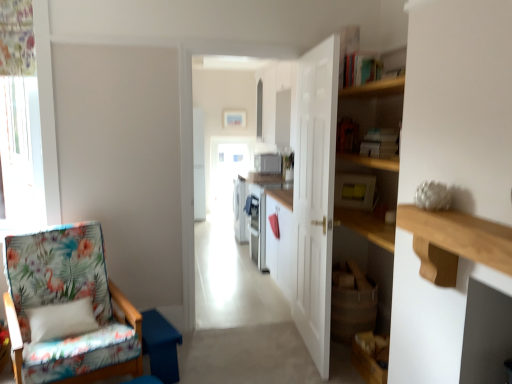
Question: From a real-world perspective, does white wooden door at center sit lower than wooden at right?

Choices:
 (A) no
 (B) yes

Answer: (B)

Question: Is white wooden door at center not close to wooden at right?

Choices:
 (A) yes
 (B) no

Answer: (A)

Question: From a real-world perspective, is white wooden door at center over wooden at right?

Choices:
 (A) yes
 (B) no

Answer: (B)

Question: Does white wooden door at center have a greater height compared to wooden at right?

Choices:
 (A) no
 (B) yes

Answer: (B)

Question: Is the depth of white wooden door at center less than that of wooden at right?

Choices:
 (A) yes
 (B) no

Answer: (B)

Question: Can you confirm if white wooden door at center is thinner than wooden at right?

Choices:
 (A) no
 (B) yes

Answer: (B)

Question: Can you confirm if white glossy microwave at center is wider than yellow plastic microwave at upper center, the 1th appliance positioned from the front?

Choices:
 (A) no
 (B) yes

Answer: (B)

Question: Considering the relative sizes of white glossy microwave at center and yellow plastic microwave at upper center, the 1th appliance positioned from the front, in the image provided, is white glossy microwave at center shorter than yellow plastic microwave at upper center, the 1th appliance positioned from the front,?

Choices:
 (A) no
 (B) yes

Answer: (A)

Question: Does white glossy microwave at center have a lesser width compared to yellow plastic microwave at upper center, which is counted as the first appliance, starting from the bottom?

Choices:
 (A) no
 (B) yes

Answer: (A)

Question: Is white glossy microwave at center further to the viewer compared to yellow plastic microwave at upper center, which is the second appliance from back to front?

Choices:
 (A) no
 (B) yes

Answer: (A)

Question: Is white glossy microwave at center with yellow plastic microwave at upper center, the second appliance from the left?

Choices:
 (A) no
 (B) yes

Answer: (A)

Question: From the image's perspective, is white glossy microwave at center located above yellow plastic microwave at upper center, the 1th appliance positioned from the front?

Choices:
 (A) no
 (B) yes

Answer: (B)

Question: From a real-world perspective, is white glossy microwave at center on top of white wooden door at center?

Choices:
 (A) yes
 (B) no

Answer: (A)